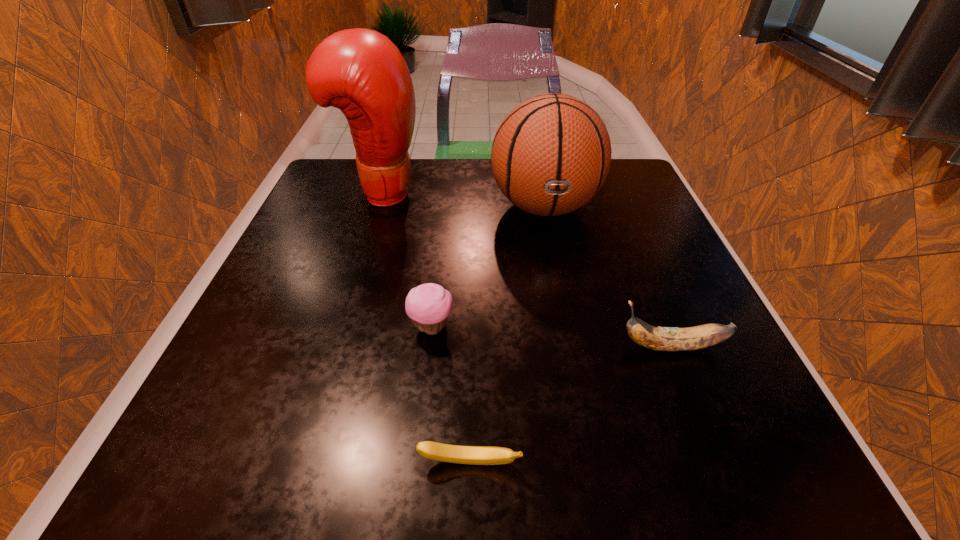
At what (x,y) coordinates should I click in order to perform the action: click on vacant region located at the stem of the taller banana. Please return your answer as a coordinate pair (x, y). Image resolution: width=960 pixels, height=540 pixels. Looking at the image, I should click on (555, 347).

Image resolution: width=960 pixels, height=540 pixels. Identify the location of free location located at the stem of the taller banana. (467, 347).

The width and height of the screenshot is (960, 540). I want to click on vacant space located 0.050m at the stem of the taller banana, so click(x=586, y=347).

Find the location of a particular element. vacant region located 0.360m on the right of the cupcake is located at coordinates (671, 327).

Locate an element on the screen. The image size is (960, 540). boxing glove situated at the far edge is located at coordinates (360, 71).

The image size is (960, 540). I want to click on basketball present at the far edge, so click(x=551, y=154).

Identify the location of object that is at the near edge. (476, 455).

The image size is (960, 540). Identify the location of object at the left edge. (360, 71).

Where is `basketball present at the right edge`? Image resolution: width=960 pixels, height=540 pixels. basketball present at the right edge is located at coordinates (551, 154).

You are a GUI agent. You are given a task and a screenshot of the screen. Output one action in this format:
    pyautogui.click(x=<x>, y=<y>)
    Task: Click on the banana present at the right edge
    The image size is (960, 540).
    Given the screenshot: What is the action you would take?
    coord(668,339)